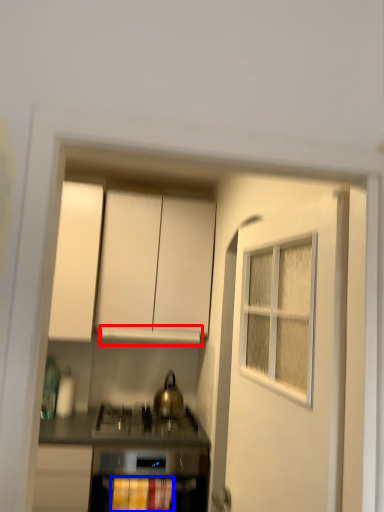
Question: Which point is further to the camera, vent (highlighted by a red box) or curtain (highlighted by a blue box)?

Choices:
 (A) vent
 (B) curtain

Answer: (A)